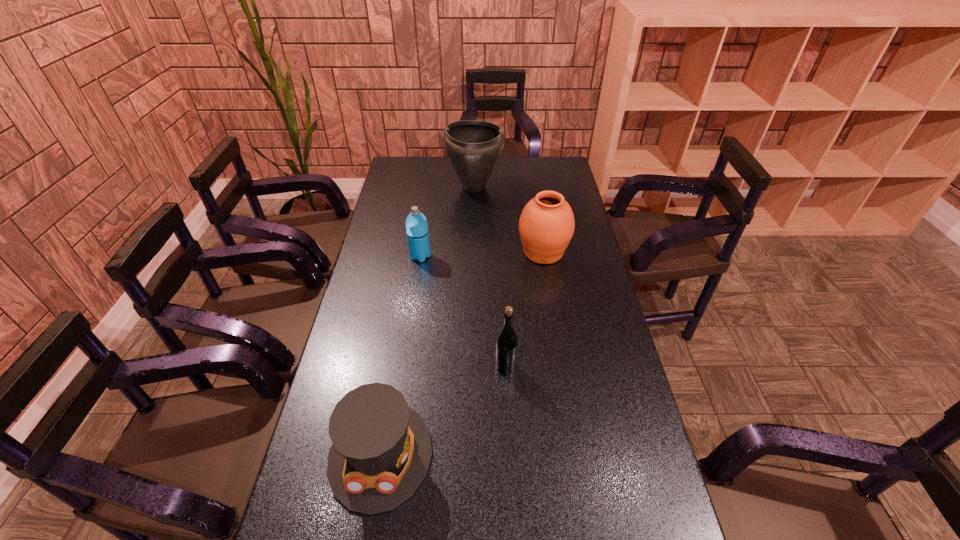
At what (x,y) coordinates should I click in order to perform the action: click on the farthest object. Please return your answer as a coordinate pair (x, y). The height and width of the screenshot is (540, 960). Looking at the image, I should click on (473, 147).

The height and width of the screenshot is (540, 960). What are the coordinates of `the farther urn` in the screenshot? It's located at (473, 147).

The height and width of the screenshot is (540, 960). What are the coordinates of `the fourth farthest object` in the screenshot? It's located at (506, 346).

Identify the location of the rightmost object. (546, 226).

Identify the location of the right urn. The height and width of the screenshot is (540, 960). click(x=546, y=226).

The width and height of the screenshot is (960, 540). I want to click on thermos bottle, so click(x=416, y=224).

I want to click on the nearest object, so click(x=381, y=451).

What are the coordinates of `dress hat` in the screenshot? It's located at (381, 451).

Find the location of a particular element. free location located 0.080m on the left of the farthest object is located at coordinates (428, 186).

Locate an element on the screen. This screenshot has height=540, width=960. vacant space located on the front of the fourth farthest object is located at coordinates (514, 531).